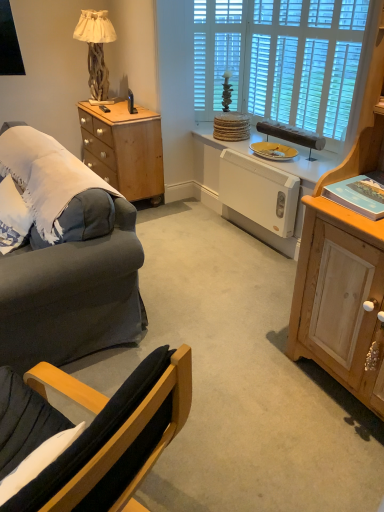
Question: Can you confirm if white wooden blinds at upper center is taller than light wood cabinet at right?

Choices:
 (A) yes
 (B) no

Answer: (B)

Question: Is white wooden blinds at upper center not within light wood cabinet at right?

Choices:
 (A) yes
 (B) no

Answer: (A)

Question: From the image's perspective, is white wooden blinds at upper center below light wood cabinet at right?

Choices:
 (A) yes
 (B) no

Answer: (B)

Question: Is white wooden blinds at upper center positioned with its back to light wood cabinet at right?

Choices:
 (A) yes
 (B) no

Answer: (B)

Question: Does white wooden blinds at upper center come behind light wood cabinet at right?

Choices:
 (A) yes
 (B) no

Answer: (A)

Question: Is white wooden blinds at upper center surrounding light wood cabinet at right?

Choices:
 (A) no
 (B) yes

Answer: (A)

Question: Is black plastic remote control at upper left wider than white wooden blinds at upper center?

Choices:
 (A) no
 (B) yes

Answer: (B)

Question: From the image's perspective, is black plastic remote control at upper left under white wooden blinds at upper center?

Choices:
 (A) yes
 (B) no

Answer: (A)

Question: Is black plastic remote control at upper left at the left side of white wooden blinds at upper center?

Choices:
 (A) no
 (B) yes

Answer: (B)

Question: From a real-world perspective, is black plastic remote control at upper left over white wooden blinds at upper center?

Choices:
 (A) yes
 (B) no

Answer: (B)

Question: Considering the relative sizes of black plastic remote control at upper left and white wooden blinds at upper center in the image provided, is black plastic remote control at upper left thinner than white wooden blinds at upper center?

Choices:
 (A) no
 (B) yes

Answer: (A)

Question: Is black plastic remote control at upper left further to camera compared to white wooden blinds at upper center?

Choices:
 (A) yes
 (B) no

Answer: (A)

Question: Can you confirm if yellow matte plate at center is positioned to the left of natural wood lamp at upper left?

Choices:
 (A) yes
 (B) no

Answer: (B)